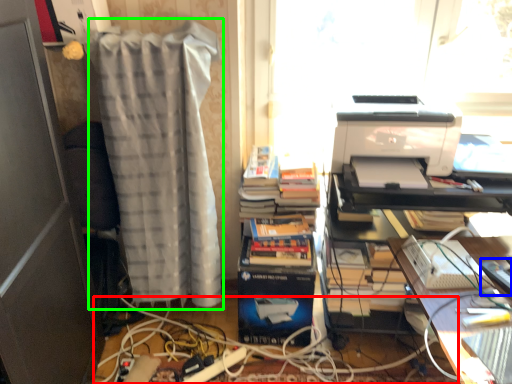
Question: Based on their relative distances, which object is farther from cable (highlighted by a red box)? Choose from equipment (highlighted by a blue box) and curtain (highlighted by a green box).

Choices:
 (A) equipment
 (B) curtain

Answer: (A)